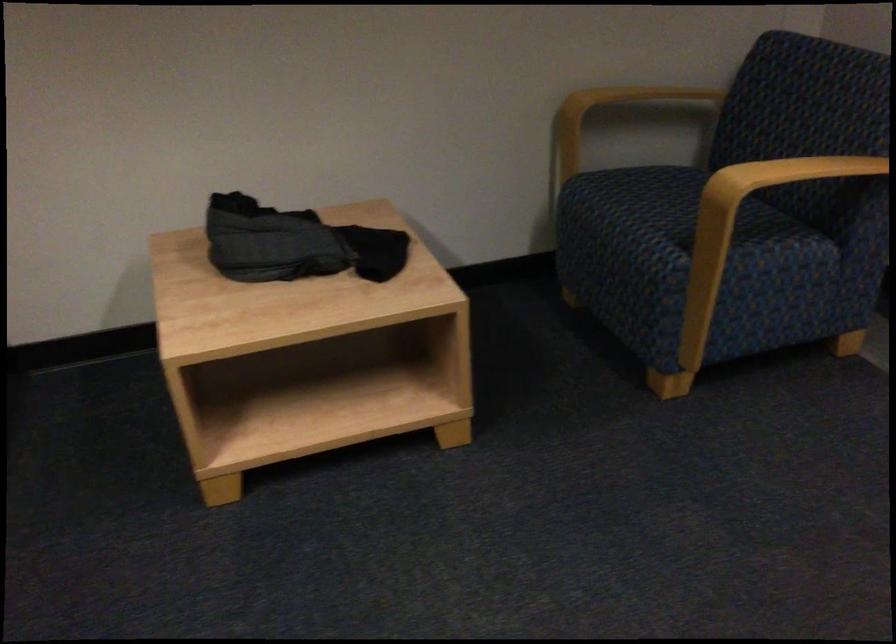
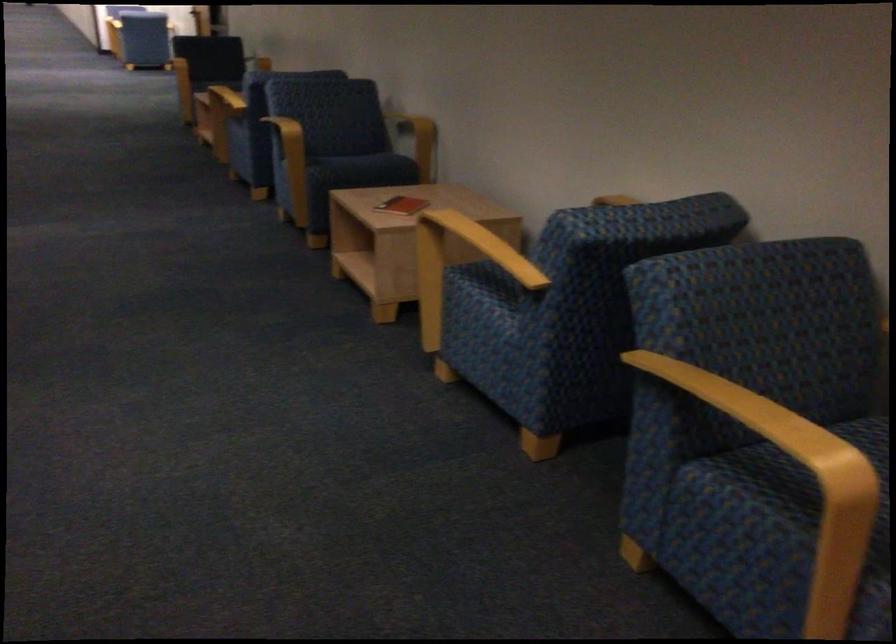
First-person continuous shooting, in which direction is the camera rotating?

The camera's rotation is toward left-down.